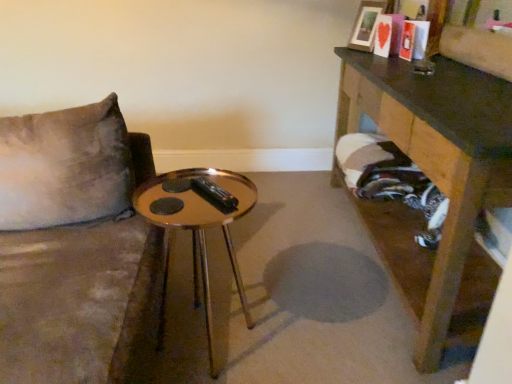
This screenshot has height=384, width=512. What are the coordinates of `vacant space behind gold reflective table at center, placed as the first table when sorted from left to right` in the screenshot? It's located at (227, 277).